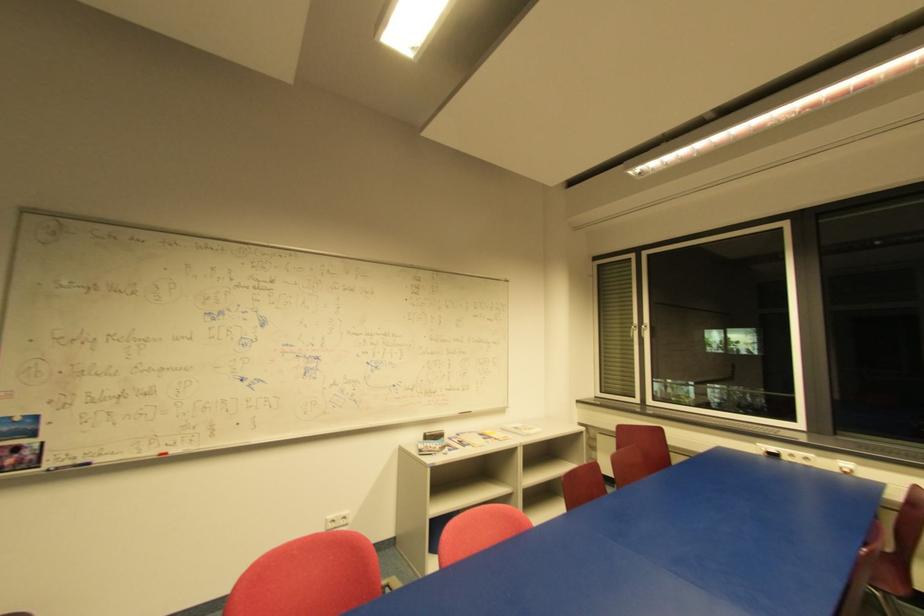
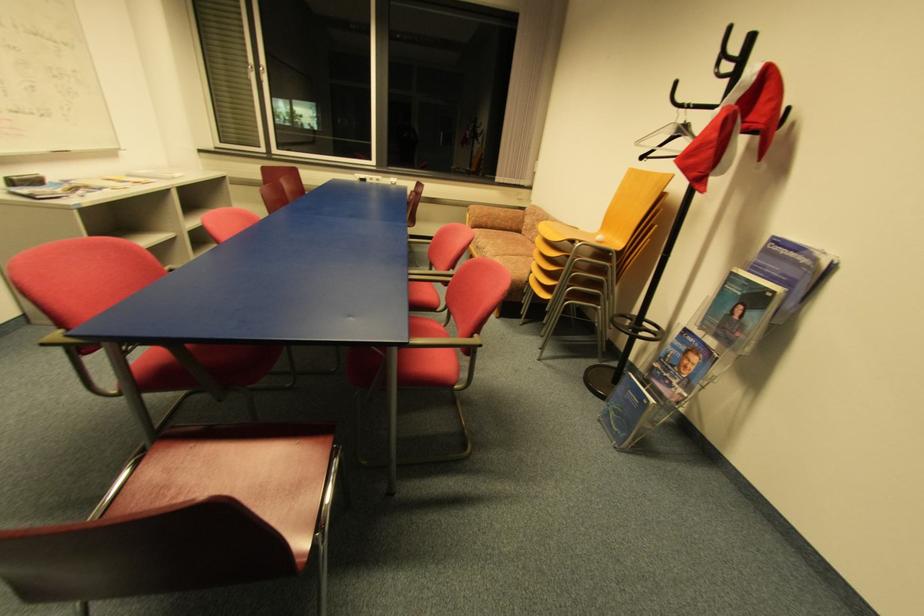
First-person continuous shooting, in which direction is the camera rotating?

The camera's rotation is toward right-down.